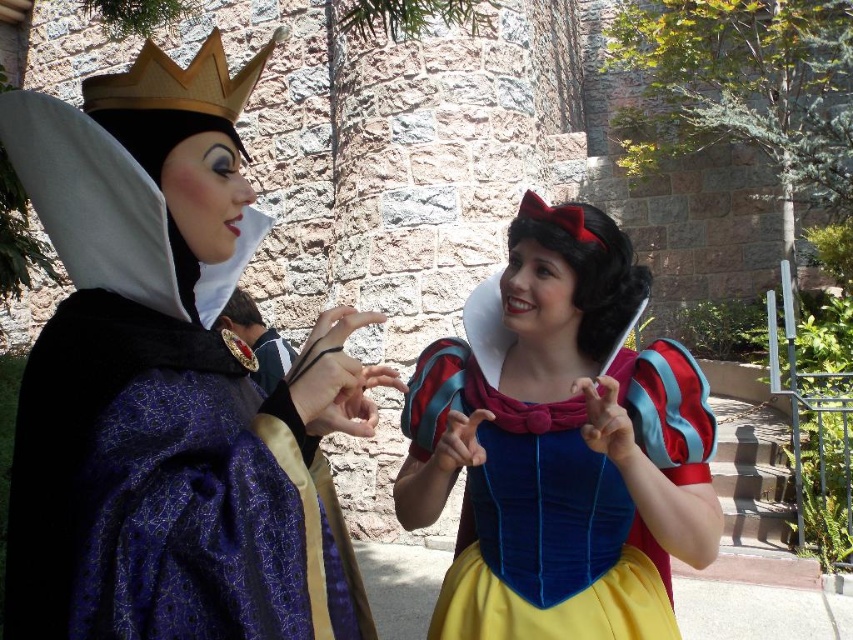
Is velvet blue dress at center shorter than gold metallic crown at upper left?

Correct, velvet blue dress at center is not as tall as gold metallic crown at upper left.

Can you confirm if velvet blue dress at center is thinner than gold metallic crown at upper left?

Correct, velvet blue dress at center's width is less than gold metallic crown at upper left's.

Is point (439, 432) positioned before point (99, 76)?

No, (439, 432) is behind (99, 76).

Where is `velvet blue dress at center`? velvet blue dress at center is located at coordinates (560, 444).

Does point (229, 604) come behind point (155, 54)?

No, (229, 604) is closer to viewer.

Is shiny purple gown at left bigger than gold metallic crown at upper left?

Yes.

The width and height of the screenshot is (853, 640). Describe the element at coordinates (167, 385) in the screenshot. I see `shiny purple gown at left` at that location.

Locate an element on the screen. shiny purple gown at left is located at coordinates (167, 385).

Is point (112, 598) positioned after point (401, 416)?

That is False.

Does shiny purple gown at left have a greater height compared to velvet blue dress at center?

Indeed, shiny purple gown at left has a greater height compared to velvet blue dress at center.

Locate an element on the screen. shiny purple gown at left is located at coordinates (167, 385).